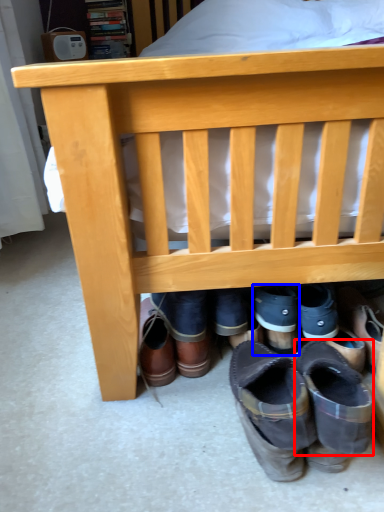
Question: Which object appears closest to the camera in this image, shoe (highlighted by a red box) or footwear (highlighted by a blue box)?

Choices:
 (A) shoe
 (B) footwear

Answer: (A)